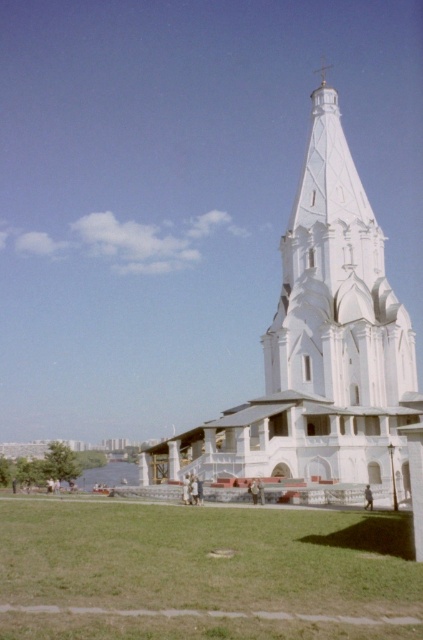
You are a gardener who needs to mow the green grass at lower center. Given that the white smooth church at center is in the way, can you mow the grass without moving the church?

The green grass at lower center is shorter than the white smooth church at center, so the church is taller than the grass. Since the church is a building, it cannot be moved, making it impossible to mow the grass without moving the church.

You are a landscape architect designing a garden around the white smooth church at center. You have a limited budget and must choose between planting more green grass at lower center or expanding the church structure. Based on their current sizes, which area would allow for more expansion without exceeding the available space?

The green grass at lower center is thinner than the white smooth church at center, so expanding the church structure would require more space than the grass area can provide. Therefore, planting more green grass at lower center is the better option as it has more room for expansion within the available space.